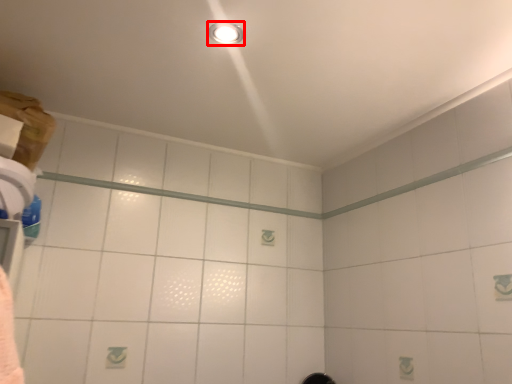
Question: Where is light fixture (annotated by the red box) located in relation to beam in the image?

Choices:
 (A) left
 (B) right

Answer: (B)